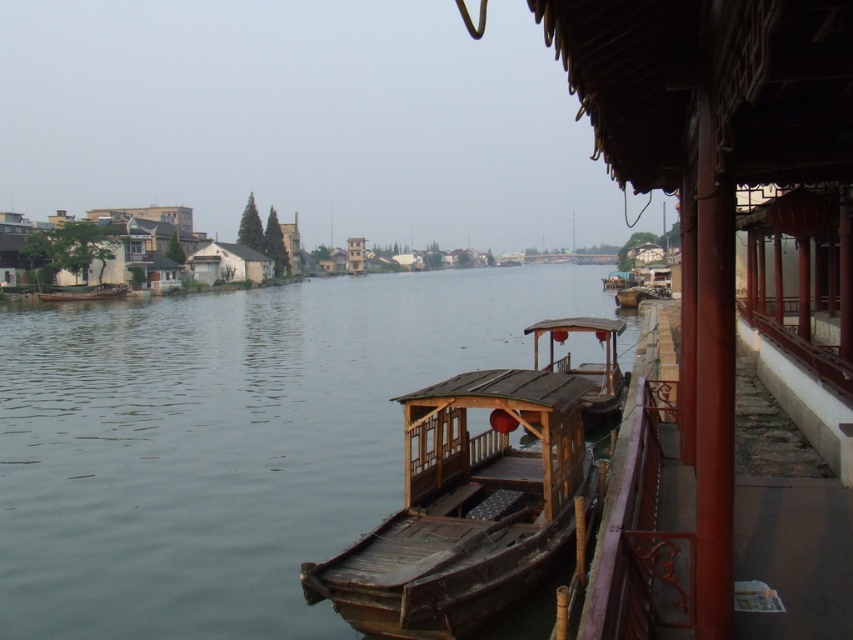
Can you confirm if brown wooden boat at center is taller than white matte hut at center?

Yes.

Between point (281, 525) and point (201, 262), which one is positioned in front?

Point (281, 525) is in front.

Where is `brown wooden boat at center`? brown wooden boat at center is located at coordinates (x=228, y=442).

Which of these two, wooden boat at right or white matte hut at center, stands taller?

white matte hut at center

Who is more distant from viewer, (445, 636) or (193, 278)?

The point (193, 278) is more distant.

Does point (498, 417) lie behind point (231, 278)?

That is False.

At what (x,y) coordinates should I click in order to perform the action: click on wooden boat at right. Please return your answer as a coordinate pair (x, y). This screenshot has height=640, width=853. Looking at the image, I should click on (480, 493).

Can you confirm if wooden boat at right is bigger than wooden boat at center?

Yes.

Can you confirm if wooden boat at right is positioned above wooden boat at center?

Incorrect, wooden boat at right is not positioned above wooden boat at center.

Is point (614, 404) positioned behind point (96, 296)?

No.

Locate an element on the screen. The image size is (853, 640). wooden boat at right is located at coordinates (480, 493).